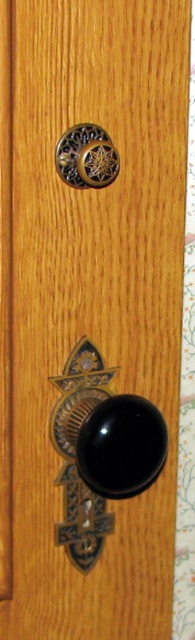
Question: Does black polished metal door handle at center have a lesser width compared to gold textured knob at upper center?

Choices:
 (A) yes
 (B) no

Answer: (B)

Question: Does black polished metal door handle at center have a smaller size compared to gold textured knob at upper center?

Choices:
 (A) yes
 (B) no

Answer: (B)

Question: Can you confirm if black polished metal door handle at center is wider than gold textured knob at upper center?

Choices:
 (A) no
 (B) yes

Answer: (B)

Question: Which of the following is the closest to the observer?

Choices:
 (A) (94, 390)
 (B) (54, 156)

Answer: (B)